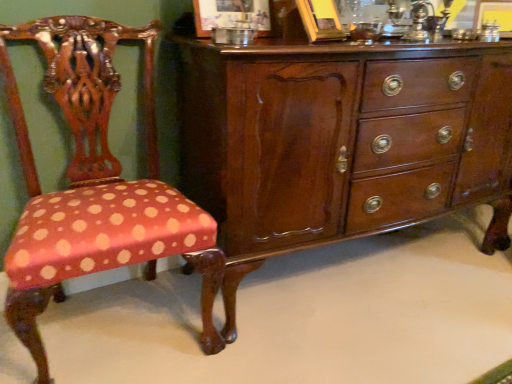
Question: In terms of size, does mahogany wood chest of drawers at center appear bigger or smaller than polka dot fabric chair at left?

Choices:
 (A) big
 (B) small

Answer: (A)

Question: From the image's perspective, is mahogany wood chest of drawers at center above or below polka dot fabric chair at left?

Choices:
 (A) below
 (B) above

Answer: (B)

Question: Is mahogany wood chest of drawers at center wider or thinner than polka dot fabric chair at left?

Choices:
 (A) thin
 (B) wide

Answer: (B)

Question: Is polka dot fabric chair at left inside or outside of mahogany wood chest of drawers at center?

Choices:
 (A) inside
 (B) outside

Answer: (B)

Question: From the image's perspective, relative to mahogany wood chest of drawers at center, is polka dot fabric chair at left above or below?

Choices:
 (A) above
 (B) below

Answer: (B)

Question: Considering the positions of polka dot fabric chair at left and mahogany wood chest of drawers at center in the image, is polka dot fabric chair at left bigger or smaller than mahogany wood chest of drawers at center?

Choices:
 (A) small
 (B) big

Answer: (A)

Question: Considering the positions of point (145, 44) and point (393, 112), is point (145, 44) closer or farther from the camera than point (393, 112)?

Choices:
 (A) closer
 (B) farther

Answer: (B)